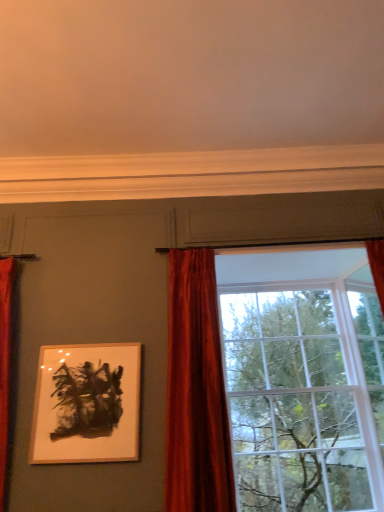
Question: Is glass window at center positioned beyond the bounds of velvet red curtain at center?

Choices:
 (A) yes
 (B) no

Answer: (A)

Question: Does glass window at center lie behind velvet red curtain at center?

Choices:
 (A) yes
 (B) no

Answer: (A)

Question: Does glass window at center have a lesser height compared to velvet red curtain at center?

Choices:
 (A) yes
 (B) no

Answer: (B)

Question: From the image's perspective, would you say glass window at center is positioned over velvet red curtain at center?

Choices:
 (A) no
 (B) yes

Answer: (A)

Question: Is glass window at center at the right side of velvet red curtain at center?

Choices:
 (A) no
 (B) yes

Answer: (B)

Question: In terms of height, does velvet red curtain at center look taller or shorter compared to glass window at center?

Choices:
 (A) tall
 (B) short

Answer: (B)

Question: Looking at their shapes, would you say velvet red curtain at center is wider or thinner than glass window at center?

Choices:
 (A) thin
 (B) wide

Answer: (A)

Question: Based on their positions, is velvet red curtain at center located to the left or right of glass window at center?

Choices:
 (A) right
 (B) left

Answer: (B)

Question: Does point (208, 351) appear closer or farther from the camera than point (205, 449)?

Choices:
 (A) closer
 (B) farther

Answer: (B)

Question: From their relative heights in the image, would you say glass window at center is taller or shorter than velvet red curtain at center?

Choices:
 (A) tall
 (B) short

Answer: (A)

Question: From the image's perspective, is glass window at center positioned above or below velvet red curtain at center?

Choices:
 (A) above
 (B) below

Answer: (B)

Question: In the image, is glass window at center positioned in front of or behind velvet red curtain at center?

Choices:
 (A) behind
 (B) front

Answer: (A)

Question: Is glass window at center wider or thinner than velvet red curtain at center?

Choices:
 (A) thin
 (B) wide

Answer: (B)

Question: Would you say velvet red curtain at center is to the left or to the right of wooden picture frame at upper left in the picture?

Choices:
 (A) left
 (B) right

Answer: (B)

Question: Do you think velvet red curtain at center is within wooden picture frame at upper left, or outside of it?

Choices:
 (A) outside
 (B) inside

Answer: (A)